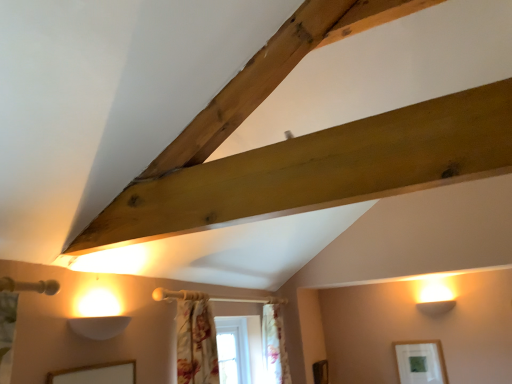
Question: Can you confirm if floral fabric curtain at center, which ranks as the 1th curtain in right-to-left order, is taller than floral fabric curtain at lower center, which is the first curtain from front to back?

Choices:
 (A) yes
 (B) no

Answer: (A)

Question: Is floral fabric curtain at center, which is the 1th curtain in back-to-front order, smaller than floral fabric curtain at lower center, placed as the 2th curtain when sorted from back to front?

Choices:
 (A) no
 (B) yes

Answer: (A)

Question: From a real-world perspective, is floral fabric curtain at center, which is the 1th curtain in back-to-front order, positioned over floral fabric curtain at lower center, which is the first curtain from front to back, based on gravity?

Choices:
 (A) no
 (B) yes

Answer: (A)

Question: Can you confirm if floral fabric curtain at center, which is the 1th curtain in back-to-front order, is positioned to the right of floral fabric curtain at lower center, the 2th curtain in the right-to-left sequence?

Choices:
 (A) yes
 (B) no

Answer: (A)

Question: From the image's perspective, is floral fabric curtain at center, the second curtain when ordered from left to right, beneath floral fabric curtain at lower center, acting as the 1th curtain starting from the left?

Choices:
 (A) yes
 (B) no

Answer: (A)

Question: Considering the relative sizes of floral fabric curtain at center, which ranks as the 1th curtain in right-to-left order, and floral fabric curtain at lower center, placed as the 2th curtain when sorted from back to front, in the image provided, is floral fabric curtain at center, which ranks as the 1th curtain in right-to-left order, bigger than floral fabric curtain at lower center, placed as the 2th curtain when sorted from back to front,?

Choices:
 (A) yes
 (B) no

Answer: (A)

Question: Does matte white picture frame at lower right have a lesser height compared to floral fabric curtain at center, which ranks as the 1th curtain in right-to-left order?

Choices:
 (A) yes
 (B) no

Answer: (A)

Question: Does matte white picture frame at lower right appear on the left side of floral fabric curtain at center, the 2th curtain positioned from the front?

Choices:
 (A) yes
 (B) no

Answer: (B)

Question: From a real-world perspective, is matte white picture frame at lower right located beneath floral fabric curtain at center, the second curtain when ordered from left to right?

Choices:
 (A) no
 (B) yes

Answer: (B)

Question: Considering the relative sizes of matte white picture frame at lower right and floral fabric curtain at center, which is the 1th curtain in back-to-front order, in the image provided, is matte white picture frame at lower right bigger than floral fabric curtain at center, which is the 1th curtain in back-to-front order,?

Choices:
 (A) no
 (B) yes

Answer: (A)

Question: Is matte white picture frame at lower right closer to camera compared to floral fabric curtain at center, the second curtain when ordered from left to right?

Choices:
 (A) yes
 (B) no

Answer: (B)

Question: Is matte white picture frame at lower right smaller than floral fabric curtain at center, the 2th curtain positioned from the front?

Choices:
 (A) yes
 (B) no

Answer: (A)

Question: Is floral fabric curtain at center, which is the 1th curtain in back-to-front order, closer to camera compared to matte white picture frame at lower right?

Choices:
 (A) yes
 (B) no

Answer: (A)